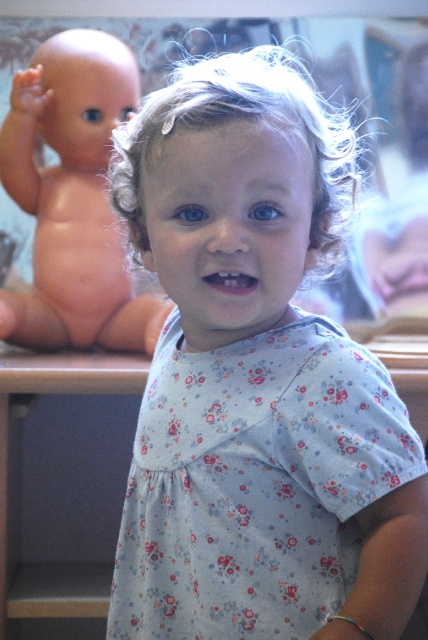
The child in the light blue dress is looking at the doll. Which object is positioned to the right of the other between the floral cotton dress at center and the pink matte doll at left?

The floral cotton dress at center is positioned to the right of the pink matte doll at left.

The child in the light blue dress is looking at the doll. Which object is larger, the floral cotton dress at center or the pink matte doll at left?

The pink matte doll at left is larger than the floral cotton dress at center.

The child wearing the floral cotton dress at center is looking at the pink matte doll at left. Which object is taller?

The pink matte doll at left is taller than the floral cotton dress at center.